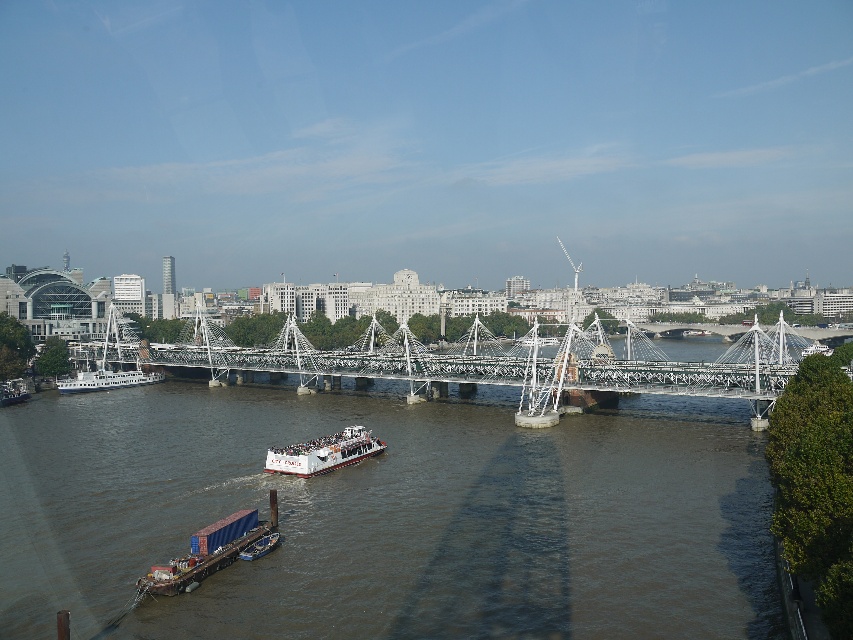
You are a drone operator planning to fly a drone between the white metallic bridge at center and the white matte boat at center. The drone has a maximum flight range of 35 meters. Can the drone safely fly between these two points without exceeding its range?

The white metallic bridge at center is 38.04 meters away from the white matte boat at center. Since the drone has a maximum flight range of 35 meters, it cannot safely fly between these two points without exceeding its range.

You are standing at the point with coordinates point (247, 509) and want to walk to the point with coordinates point (173, 442). Which direction should you face to move towards your destination?

You should face towards the direction of the suspension bridge because point (173, 442) is behind point (247, 509), meaning it is located in the direction of the bridge from your current position.